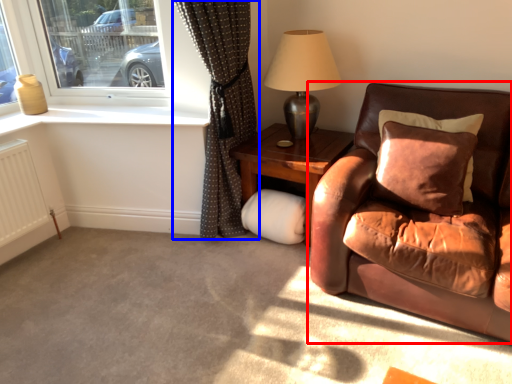
Question: Which object appears closest to the camera in this image, studio couch (highlighted by a red box) or curtain (highlighted by a blue box)?

Choices:
 (A) studio couch
 (B) curtain

Answer: (A)